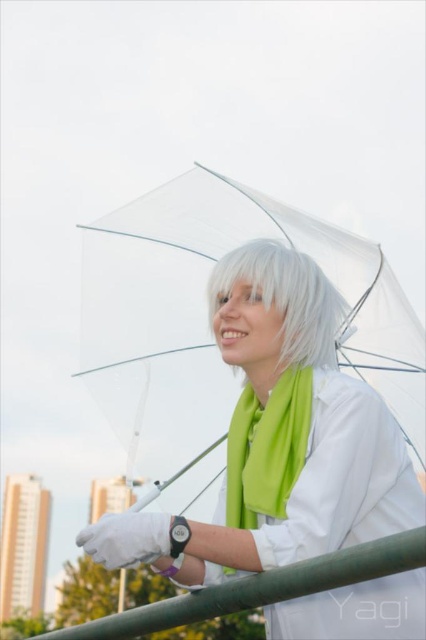
Question: Which object is the closest to the green matte scarf at center?

Choices:
 (A) white matte hair at center
 (B) translucent plastic umbrella at upper center

Answer: (B)

Question: Is translucent plastic umbrella at upper center behind white matte hair at center?

Choices:
 (A) no
 (B) yes

Answer: (A)

Question: Does green matte scarf at center have a greater width compared to white matte hair at center?

Choices:
 (A) no
 (B) yes

Answer: (A)

Question: Which point appears closest to the camera in this image?

Choices:
 (A) (319, 276)
 (B) (241, 480)
 (C) (94, 552)

Answer: (C)

Question: Is translucent plastic umbrella at upper center smaller than white matte hair at center?

Choices:
 (A) no
 (B) yes

Answer: (A)

Question: Which point is farther to the camera?

Choices:
 (A) (299, 444)
 (B) (311, 328)

Answer: (B)